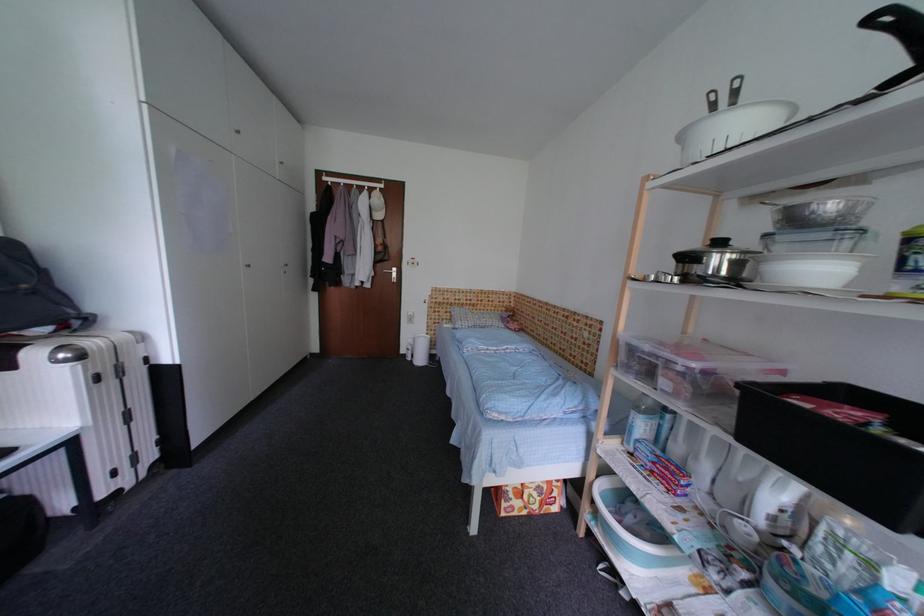
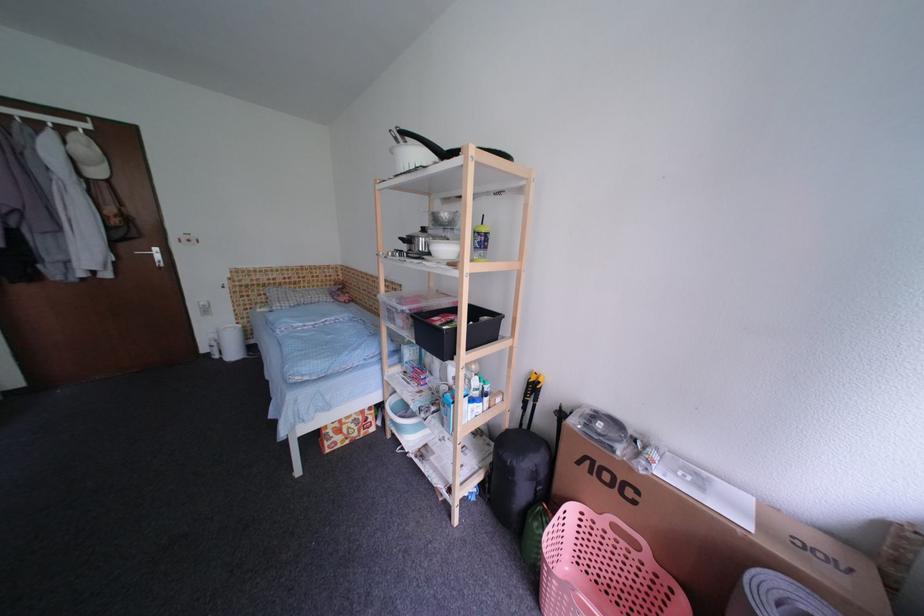
Locate, in the second image, the point that corresponds to point 419,342 in the first image.

(222, 338)